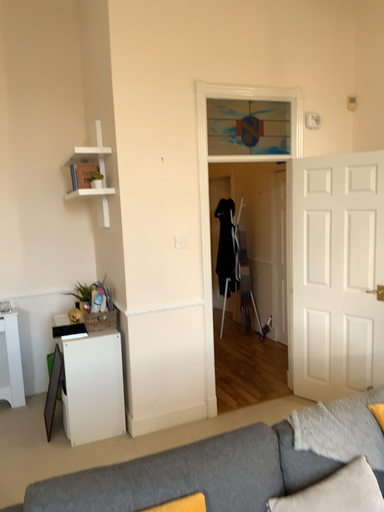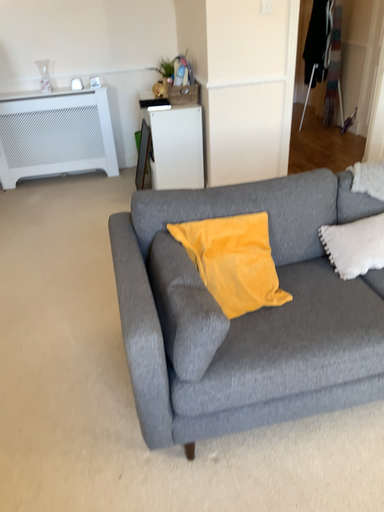
Question: Which way did the camera rotate in the video?

Choices:
 (A) rotated upward
 (B) rotated downward

Answer: (B)